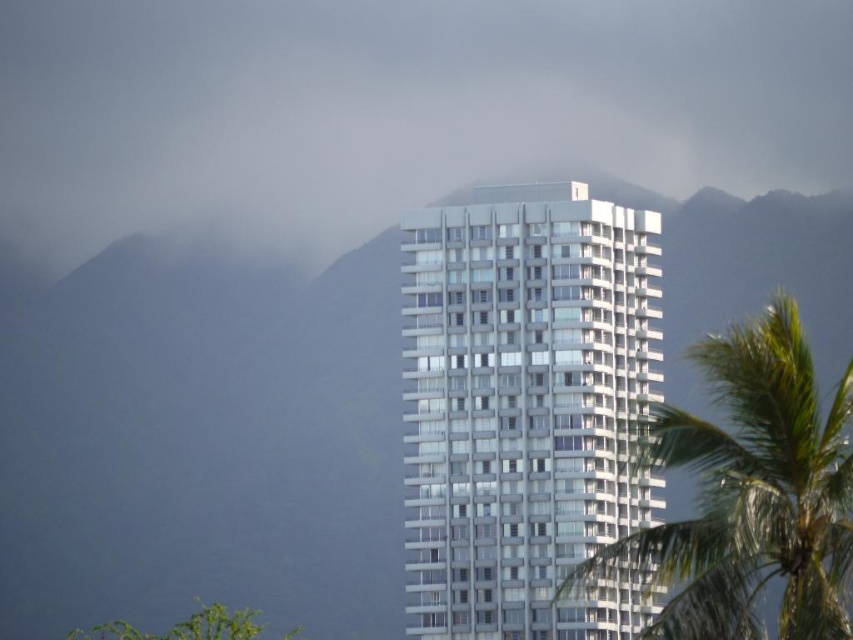
You are standing in front of the building and notice two points marked on the facade. One is at coordinates point (488, 468) and the other at point (805, 509). Which point is closer to the bottom of the building?

Point (488, 468) is closer to the bottom of the building because it is behind point (805, 509), indicating it is lower in position.